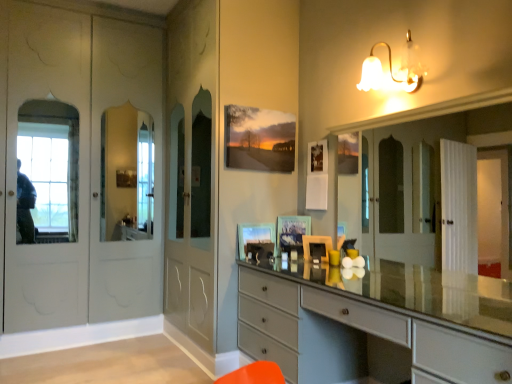
Question: Is white glass bell-shaped light fixture at upper right at the back of matte gray chest of drawers at center?

Choices:
 (A) no
 (B) yes

Answer: (A)

Question: From a real-world perspective, is matte gray chest of drawers at center physically below white glass bell-shaped light fixture at upper right?

Choices:
 (A) yes
 (B) no

Answer: (A)

Question: From the image's perspective, is matte gray chest of drawers at center below white glass bell-shaped light fixture at upper right?

Choices:
 (A) yes
 (B) no

Answer: (A)

Question: Is matte gray chest of drawers at center not within white glass bell-shaped light fixture at upper right?

Choices:
 (A) yes
 (B) no

Answer: (A)

Question: Does matte gray chest of drawers at center come behind white glass bell-shaped light fixture at upper right?

Choices:
 (A) yes
 (B) no

Answer: (B)

Question: Based on their sizes in the image, would you say matte glass picture frame at center, the 1th picture frame from the left, is bigger or smaller than matte gray chest of drawers at center?

Choices:
 (A) small
 (B) big

Answer: (A)

Question: Looking at their shapes, would you say matte glass picture frame at center, which is the 2th picture frame from right to left, is wider or thinner than matte gray chest of drawers at center?

Choices:
 (A) wide
 (B) thin

Answer: (B)

Question: Do you think matte glass picture frame at center, which is the 2th picture frame from right to left, is within matte gray chest of drawers at center, or outside of it?

Choices:
 (A) inside
 (B) outside

Answer: (B)

Question: From the image's perspective, is matte glass picture frame at center, the 1th picture frame from the left, located above or below matte gray chest of drawers at center?

Choices:
 (A) above
 (B) below

Answer: (A)

Question: Is matte glass picture frame at center, the 1th picture frame from the left, bigger or smaller than white glass bell-shaped light fixture at upper right?

Choices:
 (A) big
 (B) small

Answer: (B)

Question: Does point (252, 226) appear closer or farther from the camera than point (413, 44)?

Choices:
 (A) closer
 (B) farther

Answer: (B)

Question: Considering the relative positions of matte glass picture frame at center, which is the 2th picture frame from right to left, and white glass bell-shaped light fixture at upper right in the image provided, is matte glass picture frame at center, which is the 2th picture frame from right to left, to the left or to the right of white glass bell-shaped light fixture at upper right?

Choices:
 (A) right
 (B) left

Answer: (B)

Question: Is matte glass picture frame at center, which is the 2th picture frame from right to left, in front of or behind white glass bell-shaped light fixture at upper right in the image?

Choices:
 (A) behind
 (B) front

Answer: (A)

Question: From the image's perspective, relative to white glass bell-shaped light fixture at upper right, is matte glass picture frame at center, marked as the 2th picture frame in a left-to-right arrangement, above or below?

Choices:
 (A) above
 (B) below

Answer: (B)

Question: Does point (284, 233) appear closer or farther from the camera than point (385, 82)?

Choices:
 (A) closer
 (B) farther

Answer: (B)